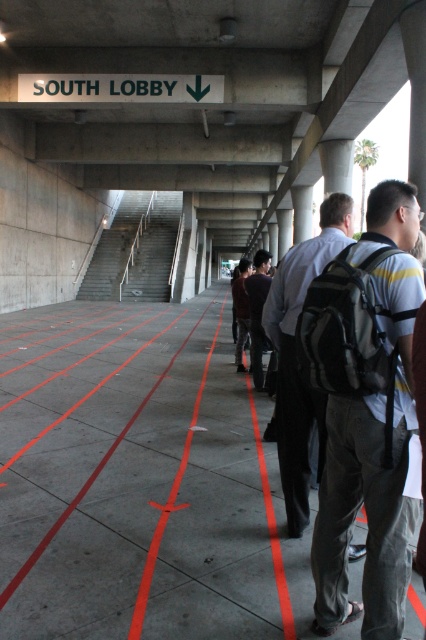
Does matte black backpack at right appear under dark gray backpack at center?

Indeed, matte black backpack at right is positioned under dark gray backpack at center.

Looking at this image, who is more distant from viewer, (281, 397) or (262, 282)?

Point (262, 282)

The width and height of the screenshot is (426, 640). Identify the location of matte black backpack at right. (296, 355).

Which is in front, point (216, 332) or point (250, 312)?

Point (250, 312) is more forward.

Who is shorter, orange painted line at center or dark gray backpack at center?

orange painted line at center

Who is more distant from viewer, (154, 552) or (249, 276)?

The point (249, 276) is behind.

Locate an element on the screen. This screenshot has height=640, width=426. orange painted line at center is located at coordinates (167, 506).

In the scene shown: Can you confirm if matte black backpack at right is positioned above black fabric pants at center?

Correct, matte black backpack at right is located above black fabric pants at center.

Where is `matte black backpack at right`? The image size is (426, 640). matte black backpack at right is located at coordinates (296, 355).

The image size is (426, 640). In order to click on matte black backpack at right in this screenshot , I will do `click(296, 355)`.